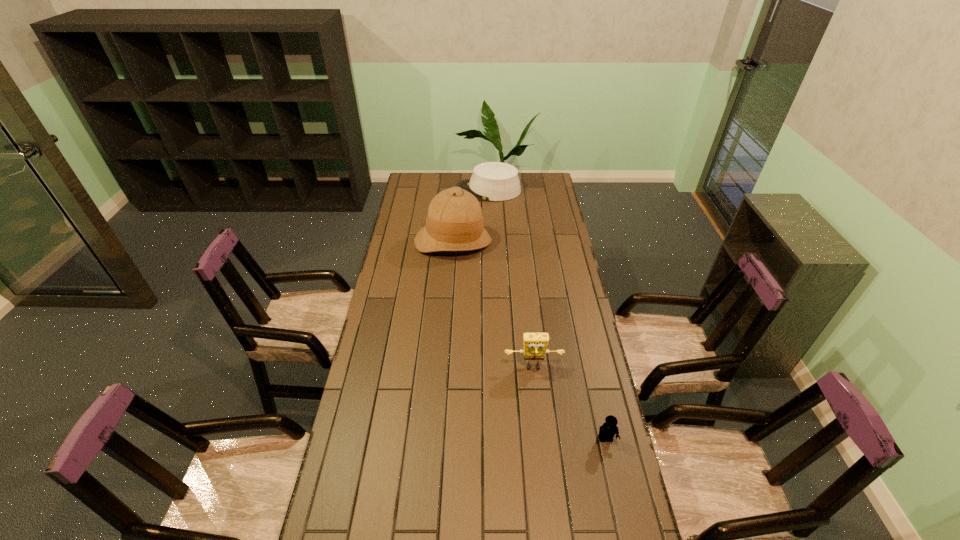
Identify the location of vacant area in the image that satisfies the following two spatial constraints: 1. on the front-facing side of the farther hat; 2. on the front-facing side of the tallest object. The image size is (960, 540). (490, 242).